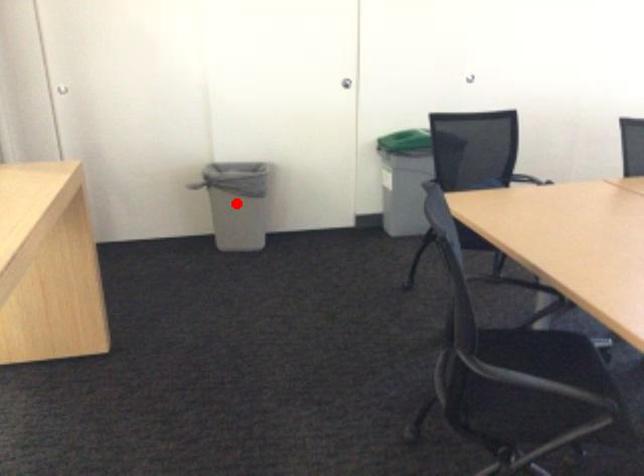
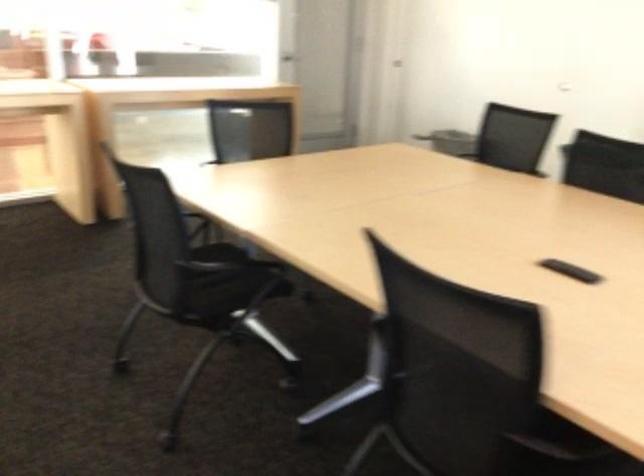
Question: I am providing you with two images of the same scene from different viewpoints. A red point is marked on the first image. Is the red point's position out of view in image 2?

Choices:
 (A) Yes
 (B) No

Answer: (A)